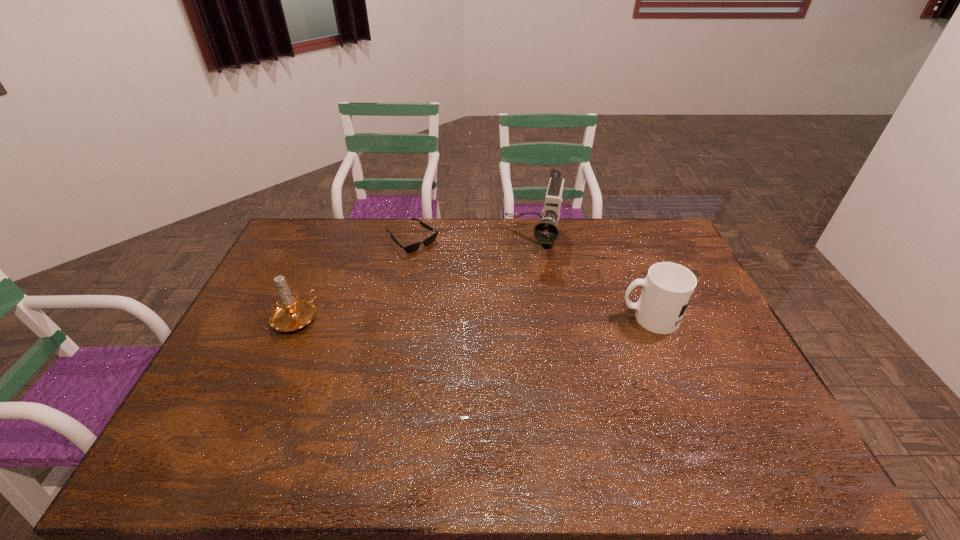
Find the location of a particular element. The image size is (960, 540). free space on the desktop that is between the leftmost object and the mug and is positioned on the recording direction of the camcorder is located at coordinates pyautogui.click(x=516, y=318).

The height and width of the screenshot is (540, 960). In order to click on free space on the desktop that is between the candle and the mug and is positioned on the front-facing side of the third object from right to left in this screenshot , I will do `click(503, 318)`.